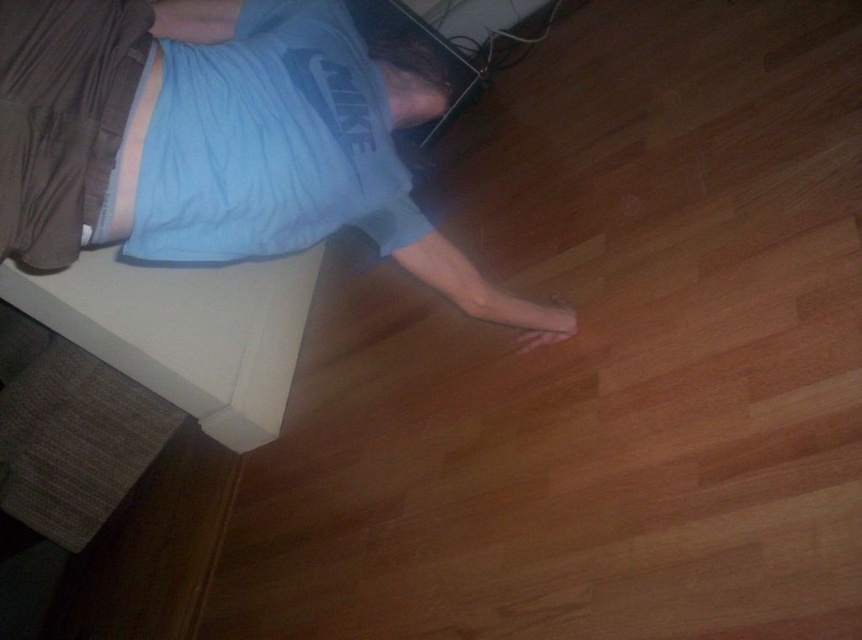
Question: Is blue cotton shirt at lower center wider than blue cotton shirt at upper left?

Choices:
 (A) no
 (B) yes

Answer: (B)

Question: Is blue cotton shirt at lower center positioned before blue cotton shirt at upper left?

Choices:
 (A) yes
 (B) no

Answer: (A)

Question: Considering the relative positions of blue cotton shirt at lower center and blue cotton shirt at upper left in the image provided, where is blue cotton shirt at lower center located with respect to blue cotton shirt at upper left?

Choices:
 (A) left
 (B) right

Answer: (B)